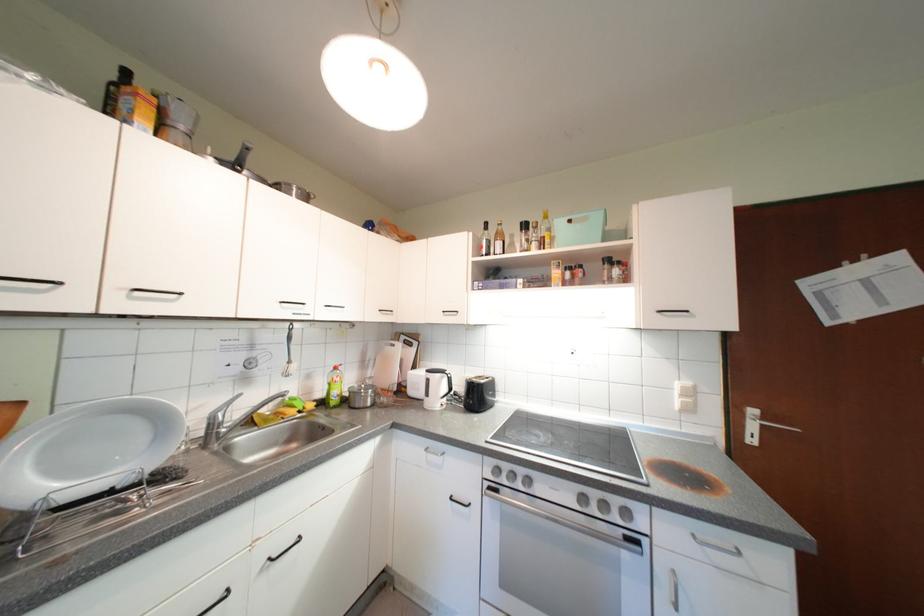
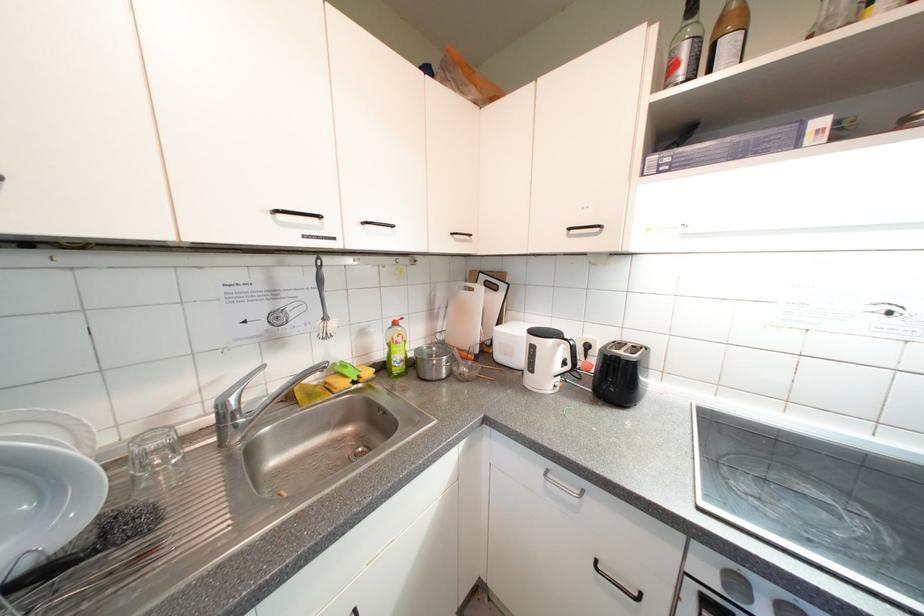
Question: How did the camera likely rotate?

Choices:
 (A) Left
 (B) Right
 (C) Up
 (D) Down

Answer: (A)